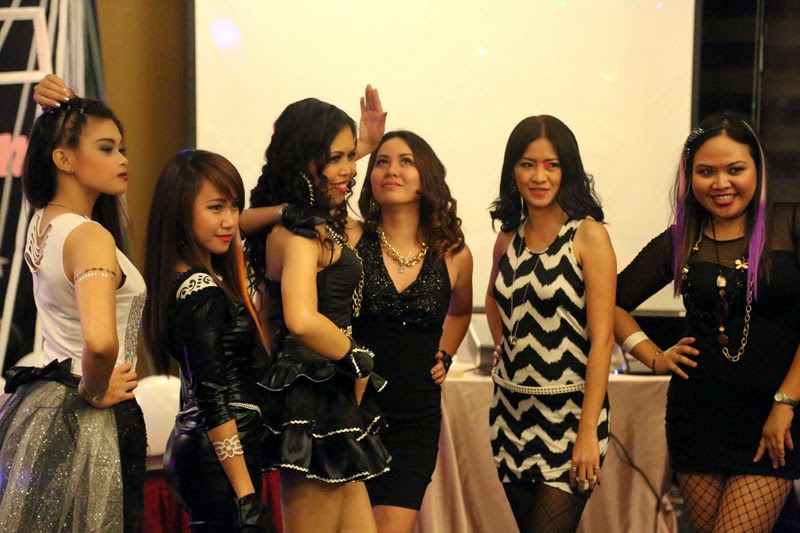
At what (x,y) coordinates should I click in order to perform the action: click on tablecloth. Please return your answer as a coordinate pair (x, y). Looking at the image, I should click on (470, 419), (650, 403).